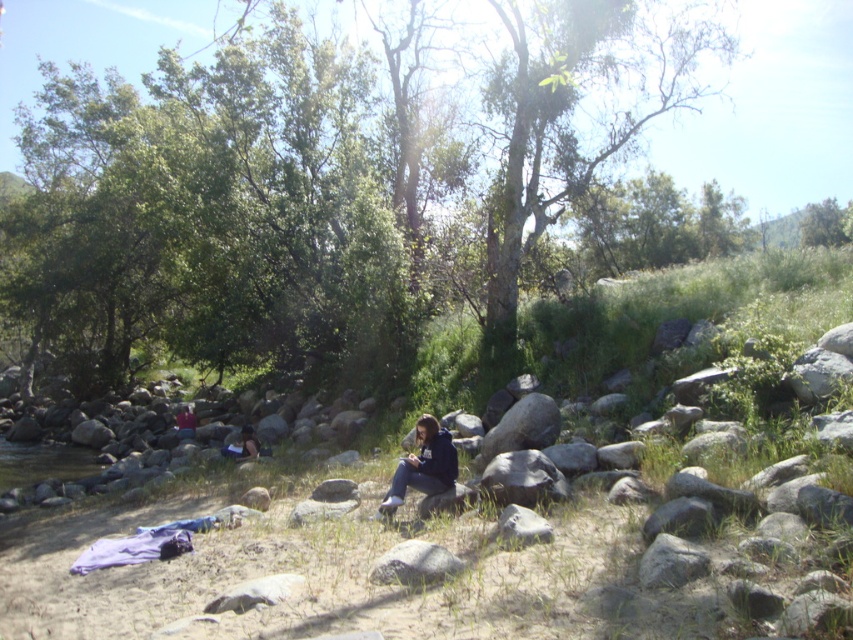
Question: Does green leafy tree at upper center have a greater width compared to gray rough rock at center?

Choices:
 (A) no
 (B) yes

Answer: (B)

Question: Does dark blue hoodie at center appear on the left side of dark blue jeans at lower left?

Choices:
 (A) no
 (B) yes

Answer: (A)

Question: Which point is farther to the camera?

Choices:
 (A) dark blue hoodie at center
 (B) smooth gray rock at center

Answer: (A)

Question: Is green leafy tree at upper center positioned at the back of dark blue jeans at center?

Choices:
 (A) yes
 (B) no

Answer: (B)

Question: Which point is closer to the camera?

Choices:
 (A) dark blue jeans at lower left
 (B) dark blue hoodie at center
 (C) smooth gray rock at center
 (D) gray rough rock at center

Answer: (C)

Question: Which point is farther from the camera taking this photo?

Choices:
 (A) (228, 84)
 (B) (444, 561)
 (C) (251, 433)

Answer: (A)